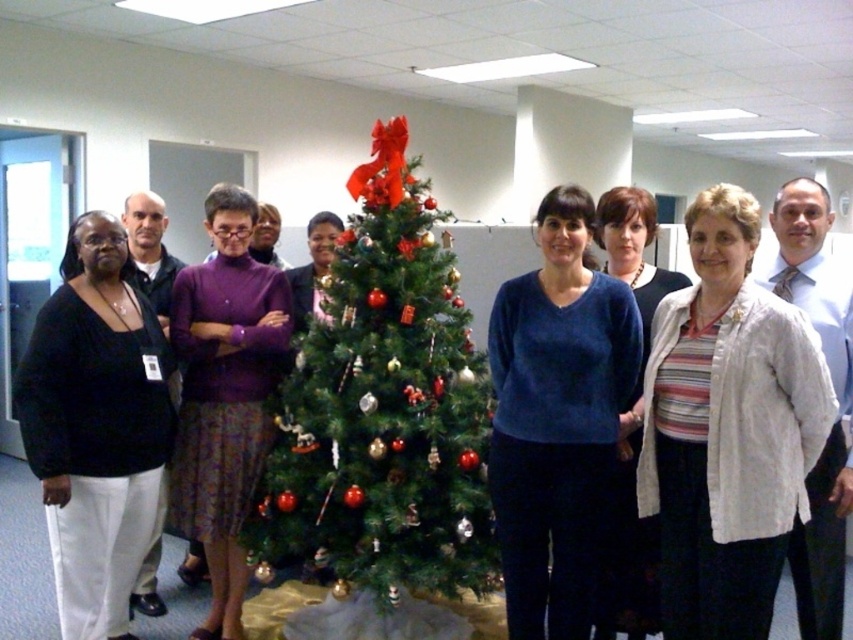
In the image of the office Christmas gathering, there is a point marked at coordinates (384, 406). Which object from the scene does this point correspond to?

The point at coordinates (384, 406) corresponds to the green textured Christmas tree at center.

You are a photographer standing in the room where the green textured christmas tree at center is placed. You want to take a photo of the tree from a distance that allows you to capture the entire tree without zooming in. Considering the average distance a photographer needs to be 2 meters away to frame a tree like this properly, is your current position suitable?

The green textured christmas tree at center and the viewer are 2.40 meters apart, which is slightly further than the recommended 2 meters. This distance should still allow you to capture the entire tree without zooming in, as being a bit farther might provide a better composition.